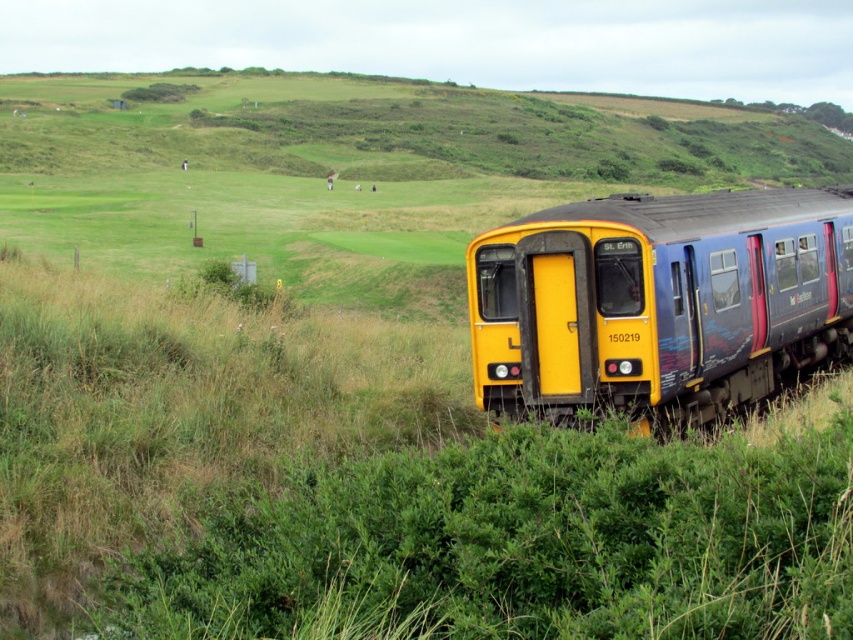
Question: Can you confirm if yellow matte train at center is positioned below green grassy hillside at upper center?

Choices:
 (A) no
 (B) yes

Answer: (B)

Question: Does yellow matte train at center appear under green grassy hillside at upper center?

Choices:
 (A) no
 (B) yes

Answer: (B)

Question: Among these points, which one is farthest from the camera?

Choices:
 (A) (607, 396)
 (B) (670, 125)

Answer: (B)

Question: Which of the following is the farthest from the observer?

Choices:
 (A) (552, 122)
 (B) (683, 397)

Answer: (A)

Question: Does yellow matte train at center appear on the right side of green grassy hillside at upper center?

Choices:
 (A) yes
 (B) no

Answer: (A)